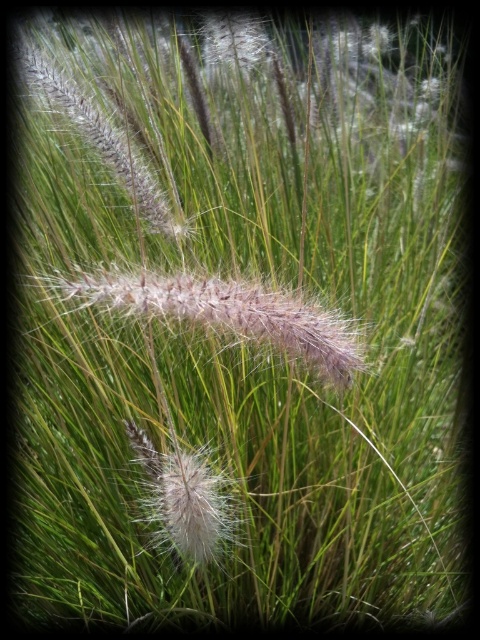
Between fuzzy brown grass at center and fuzzy white flower at center, which one is positioned higher?

Positioned higher is fuzzy brown grass at center.

Is point (269, 298) closer to viewer compared to point (219, 548)?

That is True.

Locate an element on the screen. The height and width of the screenshot is (640, 480). fuzzy brown grass at center is located at coordinates (228, 312).

Identify the location of fuzzy brown grass at center. This screenshot has width=480, height=640. (228, 312).

Can you confirm if fuzzy brown grass at center is bigger than white fluffy flower at upper center?

Incorrect, fuzzy brown grass at center is not larger than white fluffy flower at upper center.

Can you confirm if fuzzy brown grass at center is wider than white fluffy flower at upper center?

Indeed, fuzzy brown grass at center has a greater width compared to white fluffy flower at upper center.

Is point (333, 320) farther from viewer compared to point (231, 22)?

No, (333, 320) is in front of (231, 22).

In order to click on fuzzy brown grass at center in this screenshot , I will do [x=228, y=312].

Who is positioned more to the right, fuzzy white flower at center or white fluffy flower at upper center?

white fluffy flower at upper center is more to the right.

Locate an element on the screen. fuzzy white flower at center is located at coordinates (187, 500).

Image resolution: width=480 pixels, height=640 pixels. I want to click on fuzzy white flower at center, so click(187, 500).